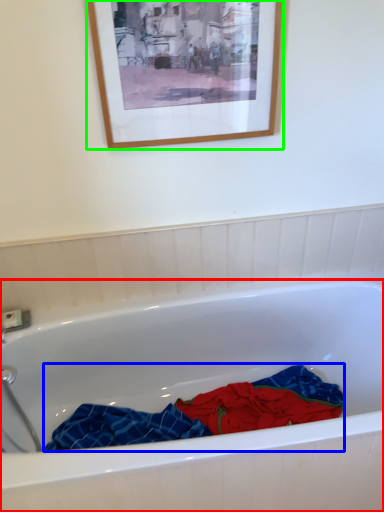
Question: Which object is the closest to the bathtub (highlighted by a red box)? Choose among these: material (highlighted by a blue box) or picture frame (highlighted by a green box).

Choices:
 (A) material
 (B) picture frame

Answer: (A)